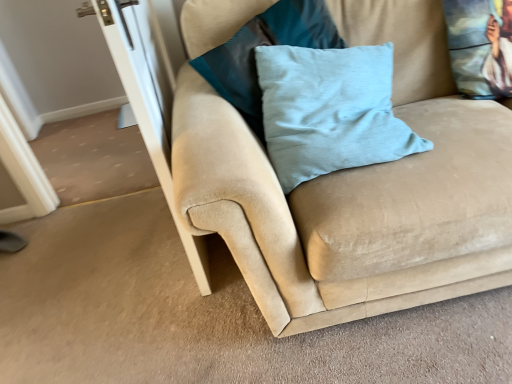
Measure the distance between light blue velvet pillow at center, which is the 2th pillow in left-to-right order, and camera.

The depth of light blue velvet pillow at center, which is the 2th pillow in left-to-right order, is 1.18 meters.

The width and height of the screenshot is (512, 384). What do you see at coordinates (151, 90) in the screenshot?
I see `transparent glass screen door at left` at bounding box center [151, 90].

Measure the distance between printed fabric cushion at upper right, which appears as the first pillow when viewed from the right, and camera.

They are 1.37 meters apart.

This screenshot has height=384, width=512. I want to click on suede couch at center, so [x=357, y=191].

Is point (111, 28) in front of point (473, 79)?

Yes, it is.

Is transparent glass screen door at left aimed at printed fabric cushion at upper right, which appears as the first pillow when viewed from the right?

No, transparent glass screen door at left is not turned towards printed fabric cushion at upper right, which appears as the first pillow when viewed from the right.

From a real-world perspective, is transparent glass screen door at left located higher than printed fabric cushion at upper right, which appears as the first pillow when viewed from the right?

Actually, transparent glass screen door at left is physically below printed fabric cushion at upper right, which appears as the first pillow when viewed from the right, in the real world.

This screenshot has height=384, width=512. Identify the location of pillow that is the 3rd one when counting rightward from the transparent glass screen door at left. (480, 46).

Which is more to the right, suede couch at center or printed fabric cushion at upper right, which appears as the first pillow when viewed from the right?

printed fabric cushion at upper right, which appears as the first pillow when viewed from the right.

Based on the photo, from the image's perspective, is suede couch at center below printed fabric cushion at upper right, which is the third pillow in left-to-right order?

Correct, suede couch at center appears lower than printed fabric cushion at upper right, which is the third pillow in left-to-right order, in the image.

Can you confirm if suede couch at center is shorter than printed fabric cushion at upper right, which is the third pillow in left-to-right order?

Result: No.

Considering the relative sizes of suede couch at center and printed fabric cushion at upper right, which appears as the first pillow when viewed from the right, in the image provided, is suede couch at center thinner than printed fabric cushion at upper right, which appears as the first pillow when viewed from the right,?

No, suede couch at center is not thinner than printed fabric cushion at upper right, which appears as the first pillow when viewed from the right.

From the image's perspective, does transparent glass screen door at left appear lower than light blue fabric pillow at center, which ranks as the 3th pillow in right-to-left order?

Yes, from the image's perspective, transparent glass screen door at left is below light blue fabric pillow at center, which ranks as the 3th pillow in right-to-left order.

Would you say transparent glass screen door at left is to the left or to the right of light blue fabric pillow at center, which ranks as the 3th pillow in right-to-left order, in the picture?

In the image, transparent glass screen door at left appears on the left side of light blue fabric pillow at center, which ranks as the 3th pillow in right-to-left order.

Considering the sizes of objects transparent glass screen door at left and light blue fabric pillow at center, which ranks as the 3th pillow in right-to-left order, in the image provided, who is smaller, transparent glass screen door at left or light blue fabric pillow at center, which ranks as the 3th pillow in right-to-left order,?

Smaller between the two is light blue fabric pillow at center, which ranks as the 3th pillow in right-to-left order.

From the image's perspective, is suede couch at center on top of light blue velvet pillow at center, the second pillow when ordered from right to left?

Incorrect, from the image's perspective, suede couch at center is lower than light blue velvet pillow at center, the second pillow when ordered from right to left.

Is suede couch at center in front of light blue velvet pillow at center, which is the 2th pillow in left-to-right order?

Yes, suede couch at center is closer to the viewer.

Which is more to the right, suede couch at center or light blue velvet pillow at center, the second pillow when ordered from right to left?

suede couch at center.

Would you consider suede couch at center to be distant from light blue velvet pillow at center, the second pillow when ordered from right to left?

They are positioned close to each other.

Is suede couch at center positioned behind light blue fabric pillow at center, which ranks as the 3th pillow in right-to-left order?

That is False.

From the image's perspective, which one is positioned higher, suede couch at center or light blue fabric pillow at center, the first pillow positioned from the left?

light blue fabric pillow at center, the first pillow positioned from the left.

Starting from the suede couch at center, which pillow is the 2nd one behind? Please provide its 2D coordinates.

[(264, 45)]

From the image's perspective, is light blue velvet pillow at center, which is the 2th pillow in left-to-right order, located beneath suede couch at center?

No.

Can you tell me how much light blue velvet pillow at center, the second pillow when ordered from right to left, and suede couch at center differ in facing direction?

light blue velvet pillow at center, the second pillow when ordered from right to left, and suede couch at center are facing 0.864 degrees away from each other.

Does light blue velvet pillow at center, which is the 2th pillow in left-to-right order, have a smaller size compared to suede couch at center?

Yes, light blue velvet pillow at center, which is the 2th pillow in left-to-right order, is smaller than suede couch at center.

Considering the positions of objects printed fabric cushion at upper right, which is the third pillow in left-to-right order, and light blue velvet pillow at center, the second pillow when ordered from right to left, in the image provided, who is more to the left, printed fabric cushion at upper right, which is the third pillow in left-to-right order, or light blue velvet pillow at center, the second pillow when ordered from right to left,?

light blue velvet pillow at center, the second pillow when ordered from right to left, is more to the left.

Are printed fabric cushion at upper right, which appears as the first pillow when viewed from the right, and light blue velvet pillow at center, which is the 2th pillow in left-to-right order, far apart?

No.

Considering their positions, is printed fabric cushion at upper right, which appears as the first pillow when viewed from the right, located in front of or behind light blue velvet pillow at center, the second pillow when ordered from right to left?

Clearly, printed fabric cushion at upper right, which appears as the first pillow when viewed from the right, is behind light blue velvet pillow at center, the second pillow when ordered from right to left.

Locate an element on the screen. The image size is (512, 384). the 3rd pillow positioned above the transparent glass screen door at left (from the image's perspective) is located at coordinates (480, 46).

Image resolution: width=512 pixels, height=384 pixels. In the image, there is a printed fabric cushion at upper right, which appears as the first pillow when viewed from the right. Find the location of `studio couch below it (from a real-world perspective)`. studio couch below it (from a real-world perspective) is located at coordinates pos(357,191).

From the image, which object appears to be farther from printed fabric cushion at upper right, which is the third pillow in left-to-right order, transparent glass screen door at left or light blue velvet pillow at center, which is the 2th pillow in left-to-right order?

transparent glass screen door at left.

When comparing their distances from suede couch at center, does printed fabric cushion at upper right, which appears as the first pillow when viewed from the right, or transparent glass screen door at left seem closer?

The object closer to suede couch at center is transparent glass screen door at left.

When comparing their distances from light blue fabric pillow at center, the first pillow positioned from the left, does printed fabric cushion at upper right, which is the third pillow in left-to-right order, or suede couch at center seem closer?

suede couch at center lies closer to light blue fabric pillow at center, the first pillow positioned from the left, than the other object.

Based on their spatial positions, is light blue fabric pillow at center, the first pillow positioned from the left, or light blue velvet pillow at center, which is the 2th pillow in left-to-right order, closer to printed fabric cushion at upper right, which appears as the first pillow when viewed from the right?

light blue velvet pillow at center, which is the 2th pillow in left-to-right order.

Estimate the real-world distances between objects in this image. Which object is closer to suede couch at center, transparent glass screen door at left or light blue fabric pillow at center, which ranks as the 3th pillow in right-to-left order?

Among the two, light blue fabric pillow at center, which ranks as the 3th pillow in right-to-left order, is located nearer to suede couch at center.

From the image, which object appears to be nearer to light blue velvet pillow at center, which is the 2th pillow in left-to-right order, printed fabric cushion at upper right, which is the third pillow in left-to-right order, or transparent glass screen door at left?

transparent glass screen door at left is positioned closer to the anchor light blue velvet pillow at center, which is the 2th pillow in left-to-right order.

When comparing their distances from transparent glass screen door at left, does printed fabric cushion at upper right, which is the third pillow in left-to-right order, or suede couch at center seem further?

Among the two, printed fabric cushion at upper right, which is the third pillow in left-to-right order, is located further to transparent glass screen door at left.

Based on their spatial positions, is suede couch at center or light blue velvet pillow at center, the second pillow when ordered from right to left, closer to printed fabric cushion at upper right, which appears as the first pillow when viewed from the right?

suede couch at center lies closer to printed fabric cushion at upper right, which appears as the first pillow when viewed from the right, than the other object.

Locate an element on the screen. This screenshot has width=512, height=384. studio couch located between transparent glass screen door at left and printed fabric cushion at upper right, which is the third pillow in left-to-right order, in the left-right direction is located at coordinates coord(357,191).

The height and width of the screenshot is (384, 512). Identify the location of pillow between light blue fabric pillow at center, the first pillow positioned from the left, and printed fabric cushion at upper right, which is the third pillow in left-to-right order, from left to right. (330, 110).

Where is `studio couch located between light blue fabric pillow at center, the first pillow positioned from the left, and printed fabric cushion at upper right, which is the third pillow in left-to-right order, in the left-right direction`? This screenshot has width=512, height=384. studio couch located between light blue fabric pillow at center, the first pillow positioned from the left, and printed fabric cushion at upper right, which is the third pillow in left-to-right order, in the left-right direction is located at coordinates (357, 191).

At what (x,y) coordinates should I click in order to perform the action: click on pillow located between transparent glass screen door at left and light blue velvet pillow at center, which is the 2th pillow in left-to-right order, in the left-right direction. Please return your answer as a coordinate pair (x, y). The image size is (512, 384). Looking at the image, I should click on [264, 45].